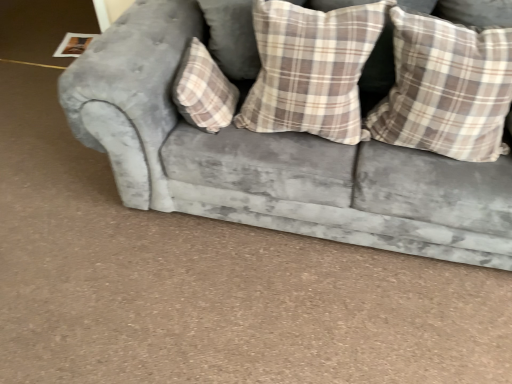
Question: Looking at the image, does velvet gray couch at center seem bigger or smaller compared to plaid fabric pillow at right, positioned as the 1th pillow in right-to-left order?

Choices:
 (A) big
 (B) small

Answer: (A)

Question: In the image, is velvet gray couch at center positioned in front of or behind plaid fabric pillow at right, positioned as the 1th pillow in right-to-left order?

Choices:
 (A) front
 (B) behind

Answer: (A)

Question: Which object is positioned closest to the plaid fabric pillow at center, positioned as the third pillow in right-to-left order?

Choices:
 (A) velvet gray couch at center
 (B) plaid fabric pillow at center, arranged as the 2th pillow when viewed from the right
 (C) plaid fabric pillow at right, which appears as the 3th pillow when viewed from the left

Answer: (B)

Question: Which object is the closest to the plaid fabric pillow at center, arranged as the 2th pillow when viewed from the right?

Choices:
 (A) velvet gray couch at center
 (B) plaid fabric pillow at center, the 1th pillow positioned from the left
 (C) plaid fabric pillow at right, which appears as the 3th pillow when viewed from the left

Answer: (C)